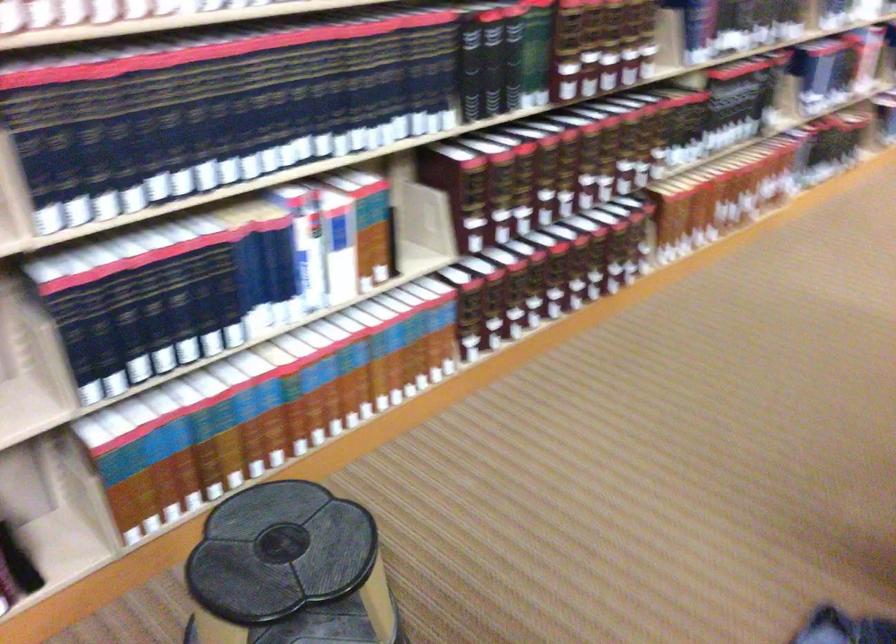
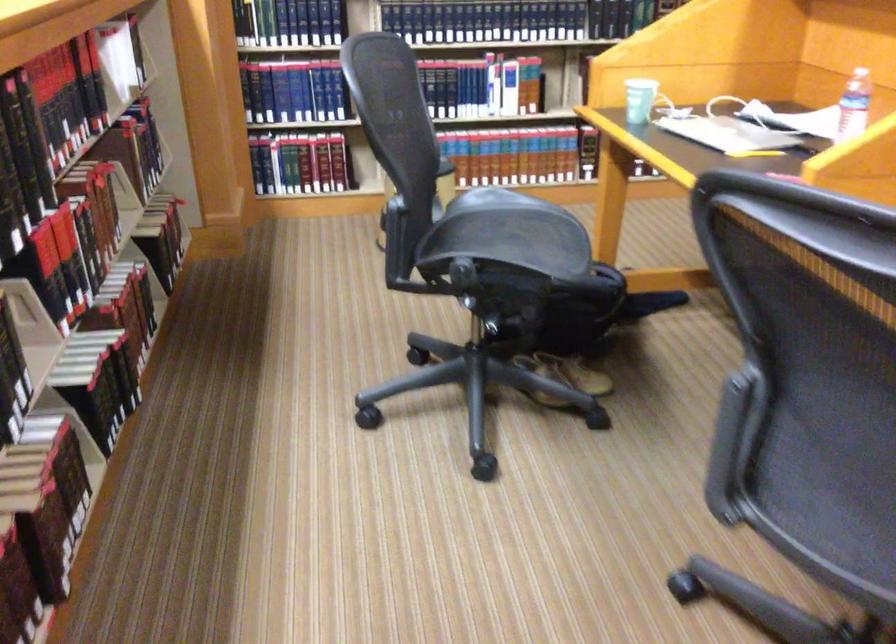
Question: I am providing you with two images of the same scene from different viewpoints. Please identify which objects are invisible in image2.

Choices:
 (A) chair sitting surface
 (B) black step stool
 (C) paper cup
 (D) recessed silver handle

Answer: (B)